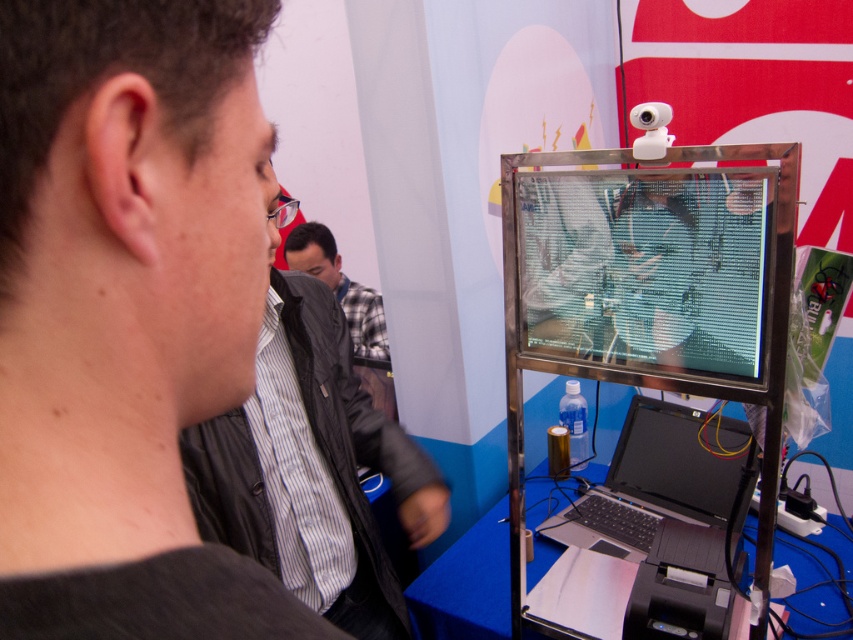
Question: Can you confirm if transparent plastic screen at center is positioned to the right of black matte laptop at center?

Choices:
 (A) yes
 (B) no

Answer: (B)

Question: Which object is the closest to the plaid fabric shirt at center?

Choices:
 (A) transparent plastic screen at center
 (B) dark gray jacket at center
 (C) black matte laptop at center

Answer: (B)

Question: Which of the following is the closest to the observer?

Choices:
 (A) transparent plastic screen at center
 (B) dark gray jacket at center
 (C) plaid fabric shirt at center

Answer: (B)

Question: Is black matte jacket at upper left closer to camera compared to plaid fabric shirt at center?

Choices:
 (A) no
 (B) yes

Answer: (B)

Question: Which of the following is the closest to the observer?

Choices:
 (A) black matte jacket at upper left
 (B) transparent plastic screen at center
 (C) black matte laptop at center

Answer: (A)

Question: Is black matte jacket at upper left positioned in front of plaid fabric shirt at center?

Choices:
 (A) no
 (B) yes

Answer: (B)